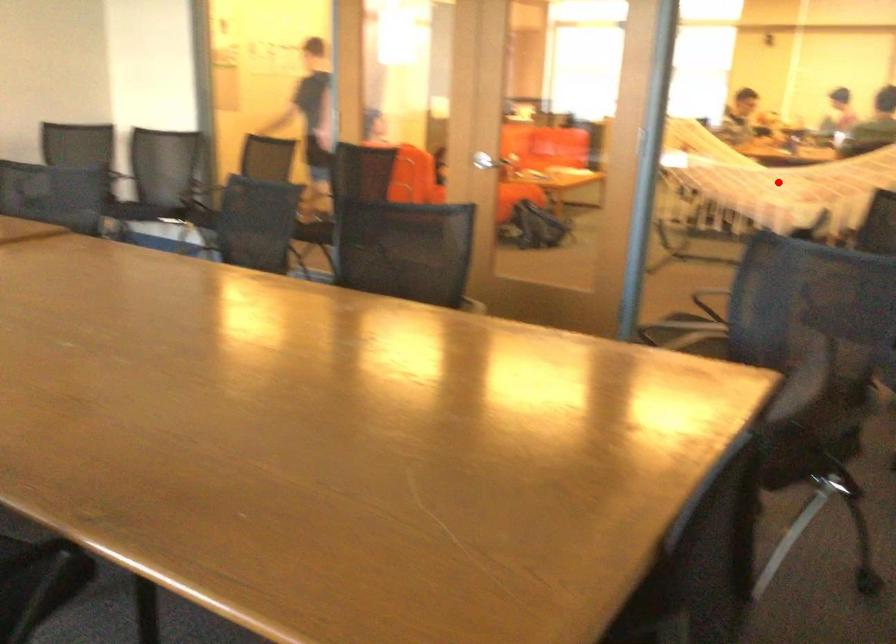
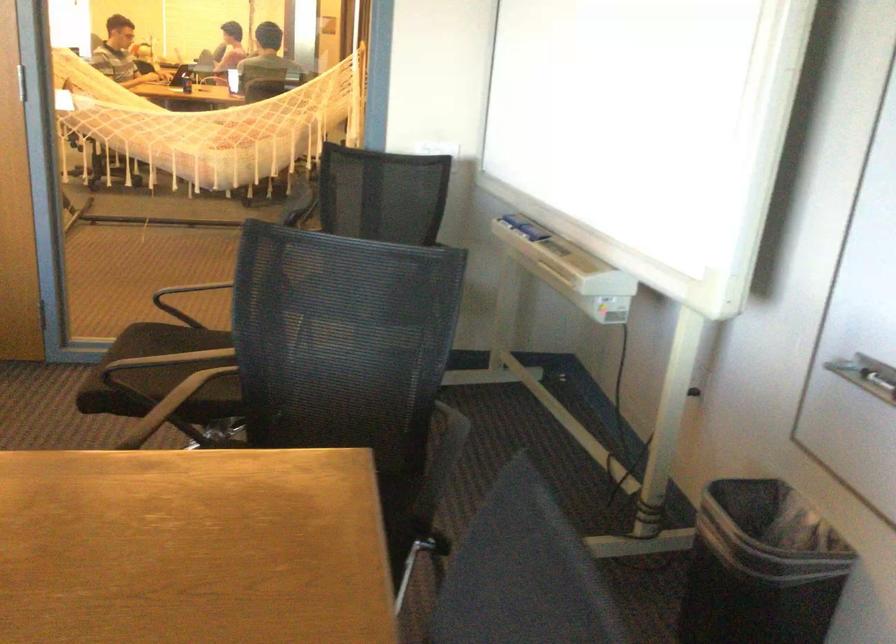
Question: I am providing you with two images of the same scene from different viewpoints. A red point is marked on the first image. Can you still see the location of the red point in image 2?

Choices:
 (A) Yes
 (B) No

Answer: (B)